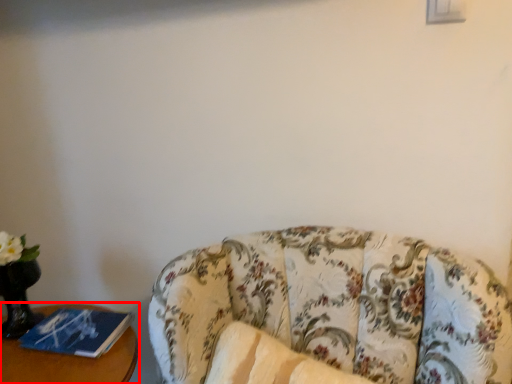
Question: From the image's perspective, where is furniture (annotated by the red box) located in relation to studio couch in the image?

Choices:
 (A) above
 (B) below

Answer: (A)